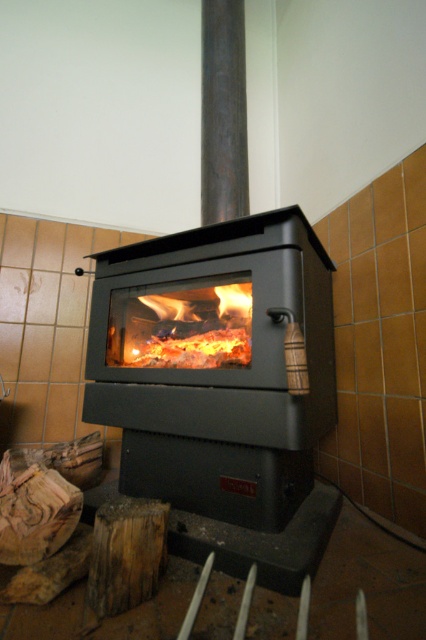
You are designing a layout for a living room and need to place a sofa. The sofa must be placed in such a way that it faces the matte black fireplace at center but is positioned away from the weathered wood at lower left. Given their sizes, which object should the sofa be closer to and why?

The sofa should be closer to the matte black fireplace at center because it has a larger size compared to the weathered wood at lower left, allowing more space between the sofa and the smaller weathered wood area.

You are a furniture designer planning to place a 16 inch wide decorative item between the matte black fireplace at center and the weathered wood at lower left. Can the item fit without overlapping either object?

The matte black fireplace at center and weathered wood at lower left are 18.73 inches apart. Since the decorative item is 16 inches wide, there is enough space between them to fit without overlapping either object.